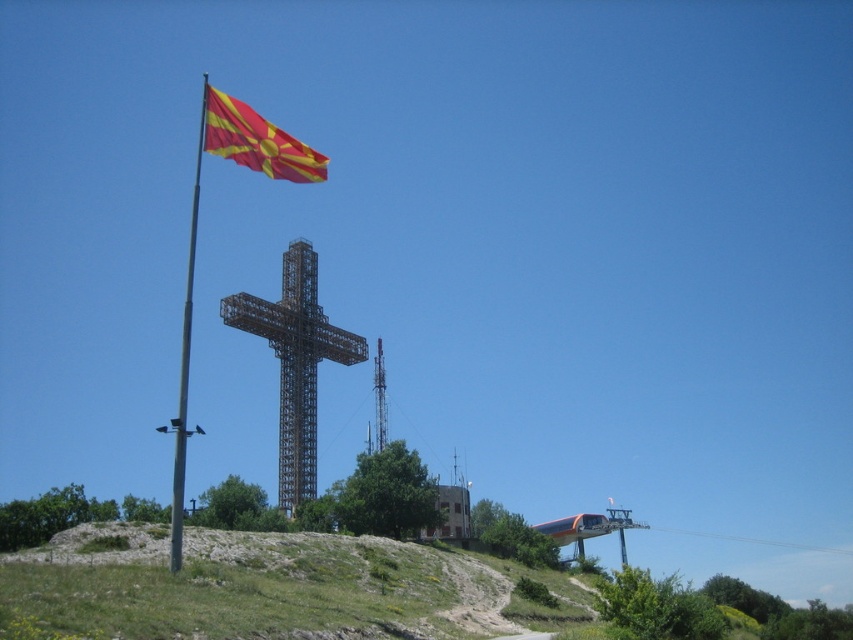
You are planning to install a new bench exactly halfway between the metallic cross at center and the metallic flag pole at left. How far in feet will the bench be from each object?

The bench will be placed exactly halfway between the metallic cross at center and the metallic flag pole at left. Since the distance between them is 63.27 feet, the bench will be 31.635 feet away from each object.

You are standing at the bottom of the grassy hill in the foreground. You want to walk directly to the red fabric flag at upper left but there is a metallic flag pole at left in your path. Can you pass through the space between them?

The red fabric flag at upper left and metallic flag pole at left are 35.52 feet apart, so yes, you can pass through the space between them since the distance is sufficient for a person to walk through.

You are standing on the grassy hill in the foreground and want to take a photo of the red fabric flag at upper left and the metallic flag pole at left. Which object is positioned to the right when viewed from your perspective?

The red fabric flag at upper left is positioned to the right of the metallic flag pole at left.